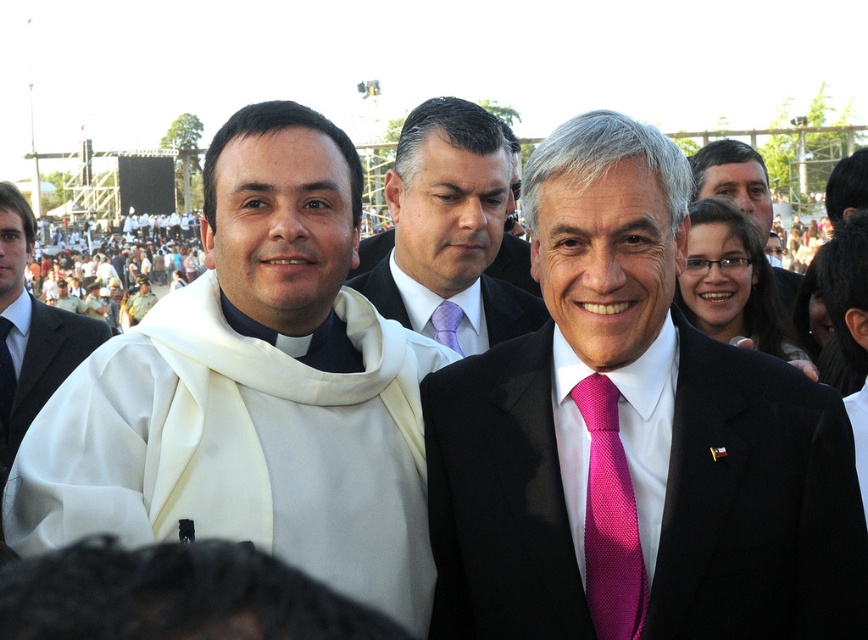
Question: Does white cloth at center have a smaller size compared to pink silk tie at upper right?

Choices:
 (A) yes
 (B) no

Answer: (B)

Question: Based on their relative distances, which object is farther from the pink silk suit at center?

Choices:
 (A) white cloth crowd at upper left
 (B) purple textured tie at center
 (C) pink textured tie at center

Answer: (A)

Question: Estimate the real-world distances between objects in this image. Which object is closer to the pink silk suit at center?

Choices:
 (A) white cloth at center
 (B) purple textured tie at center
 (C) pink textured tie at center
 (D) white cloth at left

Answer: (C)

Question: Is white cloth at left further to camera compared to purple satin suit at center?

Choices:
 (A) no
 (B) yes

Answer: (A)

Question: Is purple satin tie at center smaller than white cloth crowd at upper left?

Choices:
 (A) yes
 (B) no

Answer: (A)

Question: Based on their relative distances, which object is nearer to the pink textured tie at center?

Choices:
 (A) purple satin suit at center
 (B) purple textured tie at center
 (C) purple satin tie at center

Answer: (A)